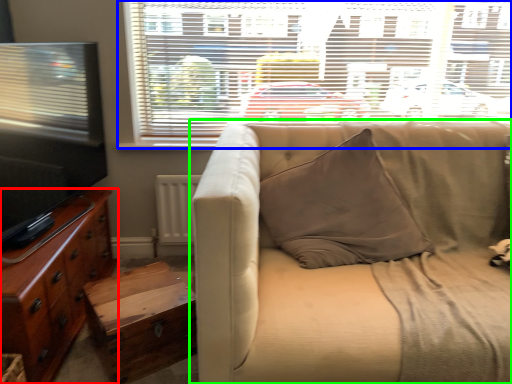
Question: Which object is the closest to the cabinetry (highlighted by a red box)? Choose among these: window (highlighted by a blue box) or studio couch (highlighted by a green box).

Choices:
 (A) window
 (B) studio couch

Answer: (B)